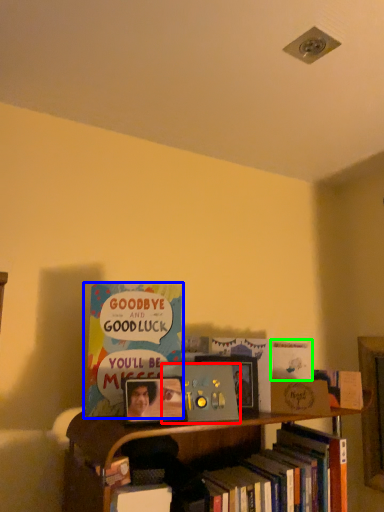
Question: Which object is positioned farthest from book (highlighted by a red box)? Select from book (highlighted by a blue box) and book (highlighted by a green box).

Choices:
 (A) book
 (B) book

Answer: (B)